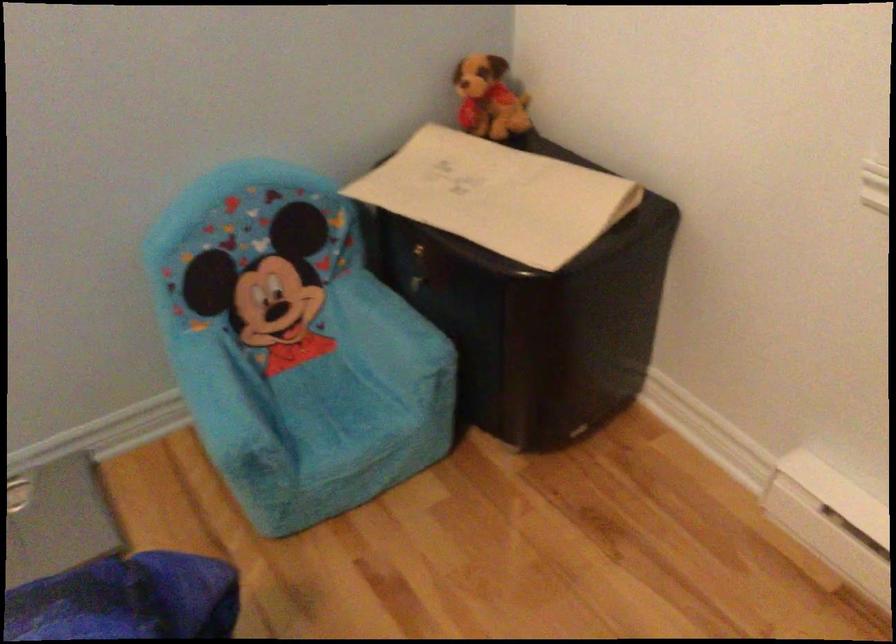
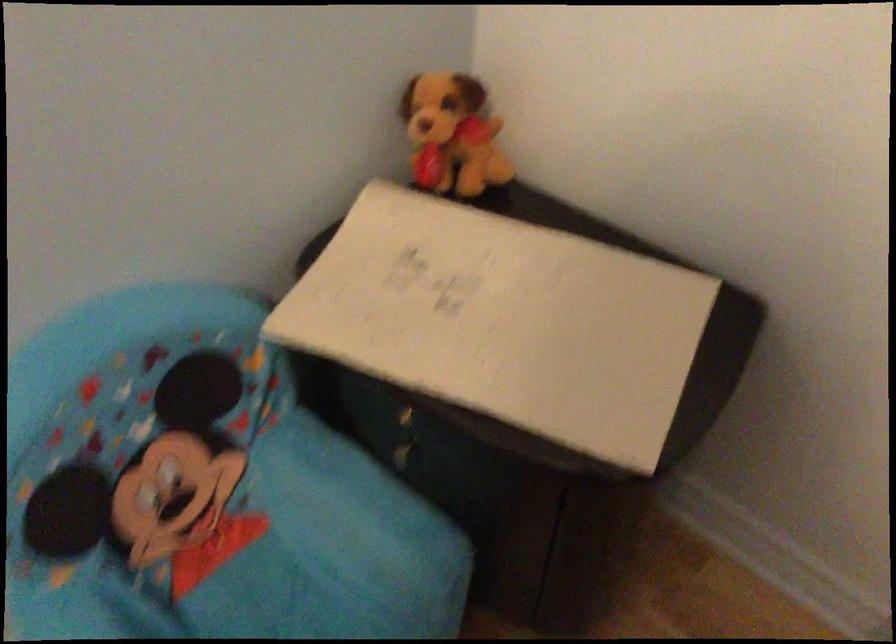
Question: The camera is either moving clockwise (left) or counter-clockwise (right) around the object. The first image is from the beginning of the video and the second image is from the end. Is the camera moving left or right when shooting the video?

Choices:
 (A) Left
 (B) Right

Answer: (A)